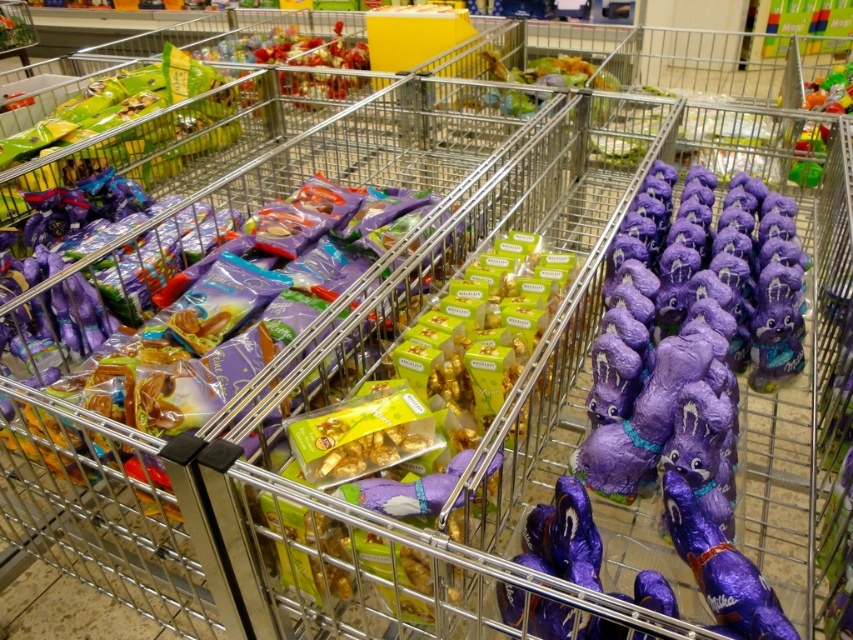
Question: Considering the relative positions of purple shiny chocolate bunny at right and purple foil chocolate at center in the image provided, where is purple shiny chocolate bunny at right located with respect to purple foil chocolate at center?

Choices:
 (A) left
 (B) right

Answer: (B)

Question: Which object is closer to the camera taking this photo?

Choices:
 (A) purple foil chocolate at center
 (B) purple shiny chocolate bunny at right

Answer: (A)

Question: Is purple shiny chocolate bunny at right above purple foil chocolate at center?

Choices:
 (A) no
 (B) yes

Answer: (B)

Question: From the image, what is the correct spatial relationship of purple shiny chocolate bunny at right in relation to purple foil chocolate at center?

Choices:
 (A) left
 (B) right

Answer: (B)